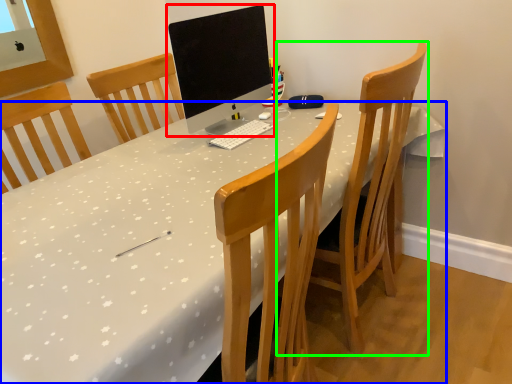
Question: Which object is the farthest from computer monitor (highlighted by a red box)? Choose among these: desk (highlighted by a blue box) or chair (highlighted by a green box).

Choices:
 (A) desk
 (B) chair

Answer: (B)